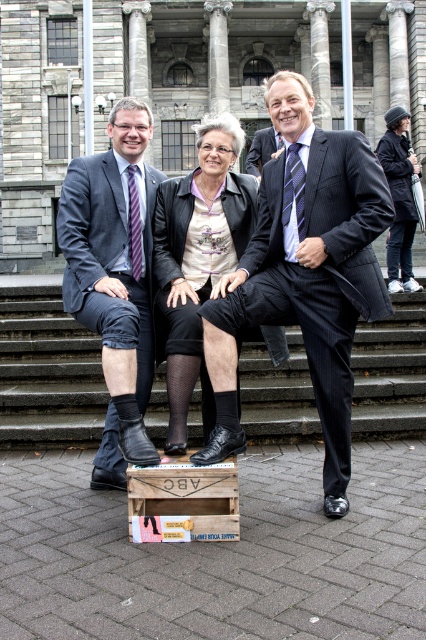
Question: Which object appears farthest from the camera in this image?

Choices:
 (A) dark pinstripe suit at center
 (B) black knit beanie at upper right
 (C) matte black jacket at center
 (D) wooden crate at lower center

Answer: (B)

Question: Can you confirm if wooden crate at lower center is positioned below black knit beanie at upper right?

Choices:
 (A) yes
 (B) no

Answer: (A)

Question: Among these points, which one is nearest to the camera?

Choices:
 (A) (85, 371)
 (B) (233, 216)
 (C) (132, 536)

Answer: (C)

Question: Can you confirm if matte black jacket at center is positioned to the right of black knit beanie at upper right?

Choices:
 (A) yes
 (B) no

Answer: (B)

Question: Which of the following is the farthest from the observer?

Choices:
 (A) wooden crate at lower center
 (B) matte black suit at center
 (C) matte black jacket at center

Answer: (C)

Question: Does dark pinstripe suit at center have a larger size compared to matte black jacket at center?

Choices:
 (A) yes
 (B) no

Answer: (B)